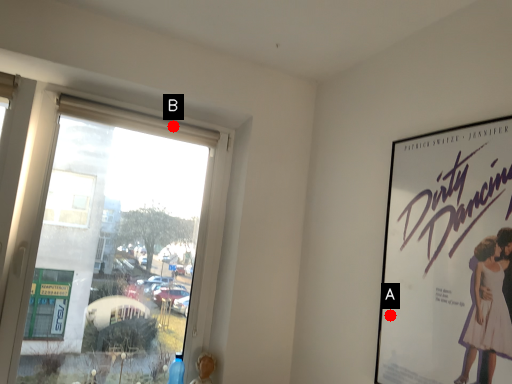
Question: Two points are circled on the image, labeled by A and B beside each circle. Among these points, which one is farthest from the camera?

Choices:
 (A) A is further
 (B) B is further

Answer: (B)